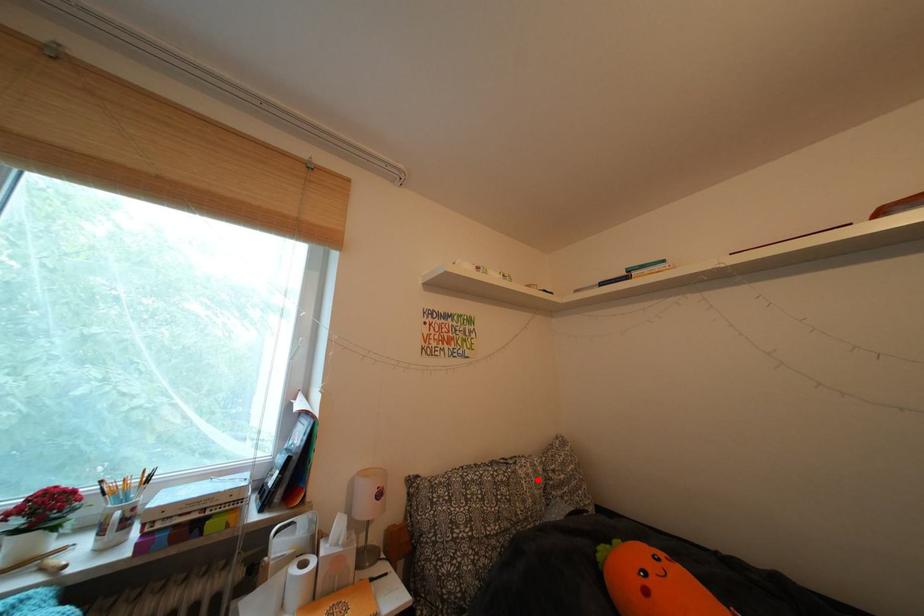
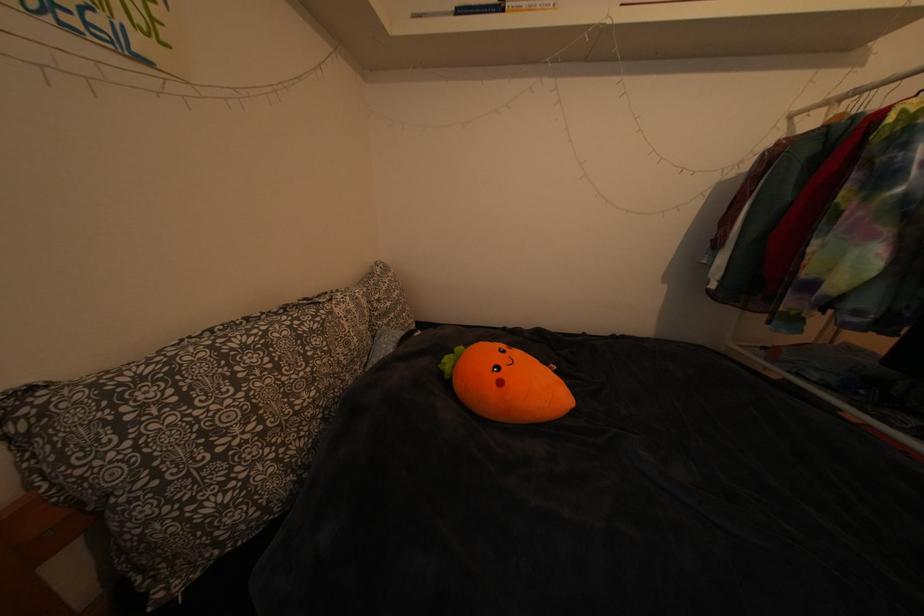
Find the pixel in the second image that matches the highlighted location in the first image.

(359, 317)